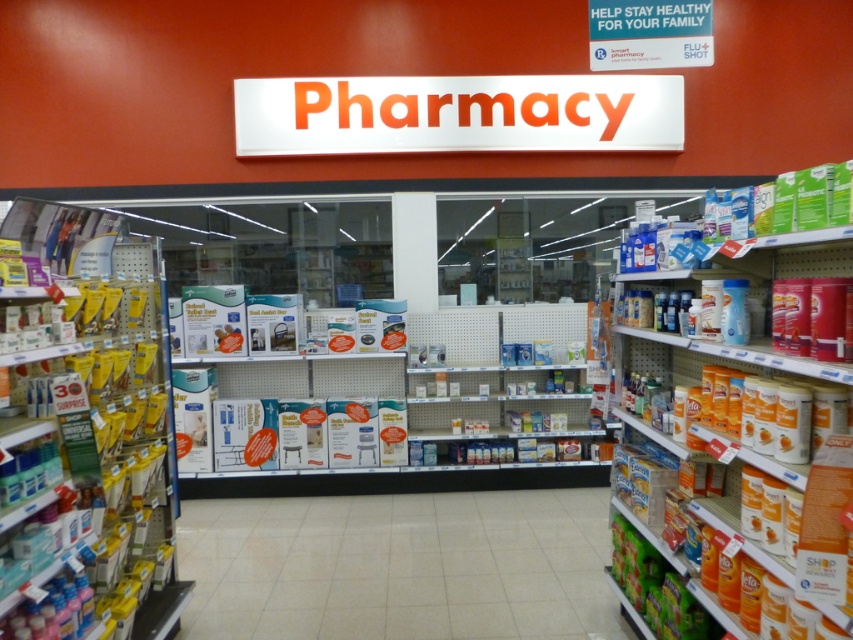
Question: Which point is farther to the camera?

Choices:
 (A) white tile floor at center
 (B) yellow plastic boxes at left

Answer: (A)

Question: Can you confirm if white tile floor at center is smaller than orange cardboard boxes at right?

Choices:
 (A) no
 (B) yes

Answer: (B)

Question: Does white tile floor at center appear under orange cardboard boxes at right?

Choices:
 (A) yes
 (B) no

Answer: (A)

Question: Is white tile floor at center closer to camera compared to orange cardboard boxes at right?

Choices:
 (A) yes
 (B) no

Answer: (B)

Question: Estimate the real-world distances between objects in this image. Which object is closer to the white tile floor at center?

Choices:
 (A) orange cardboard boxes at right
 (B) yellow plastic boxes at left

Answer: (B)

Question: Which of the following is the closest to the observer?

Choices:
 (A) (839, 582)
 (B) (102, 269)

Answer: (A)